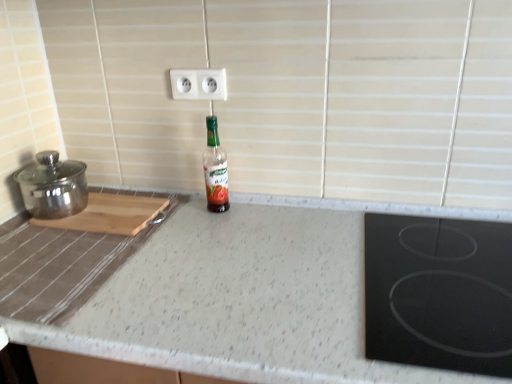
Identify the location of free point above speckled granite countertop at center (from a real-world perspective). point(236,274).